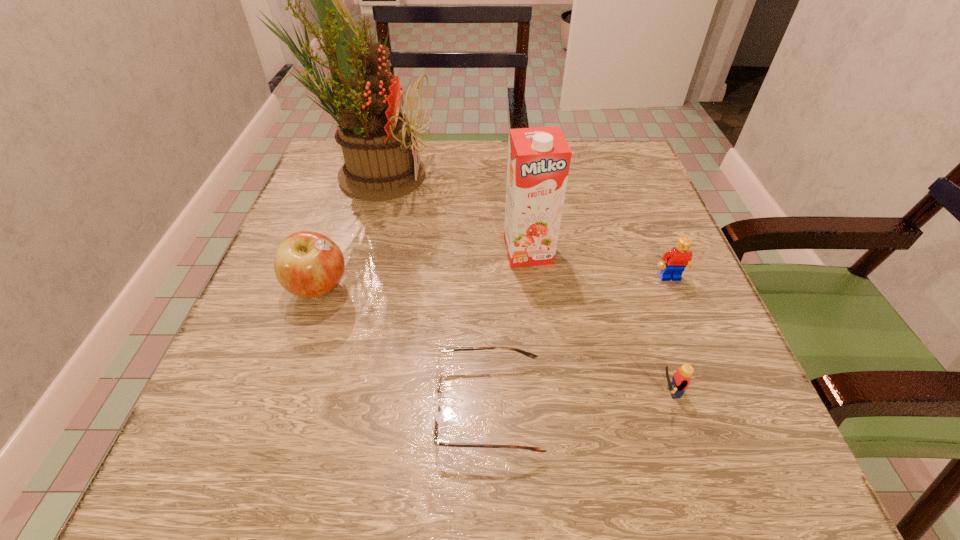
The height and width of the screenshot is (540, 960). I want to click on vacant space that is in between the left Lego and the apple, so click(491, 340).

This screenshot has width=960, height=540. In order to click on free space between the spectacles and the apple in this screenshot , I will do `click(403, 348)`.

Find the location of a particular element. The width and height of the screenshot is (960, 540). vacant area that lies between the fifth object from left to right and the right Lego is located at coordinates (666, 335).

Image resolution: width=960 pixels, height=540 pixels. What are the coordinates of `free space between the farther Lego and the apple` in the screenshot? It's located at (494, 283).

This screenshot has width=960, height=540. Identify the location of free spot between the apple and the right Lego. (494, 283).

This screenshot has width=960, height=540. I want to click on free space between the shortest object and the left Lego, so click(575, 400).

The width and height of the screenshot is (960, 540). I want to click on empty space between the right Lego and the carton, so click(599, 265).

What are the coordinates of `free spot between the shortest object and the second object from right to left` in the screenshot? It's located at (575, 400).

Where is `free space that is in between the spectacles and the carton`? The image size is (960, 540). free space that is in between the spectacles and the carton is located at coordinates (508, 329).

Choose which object is the fifth nearest neighbor to the carton. Please provide its 2D coordinates. Your answer should be formatted as a tuple, i.e. [(x, y)], where the tuple contains the x and y coordinates of a point satisfying the conditions above.

[(307, 264)]